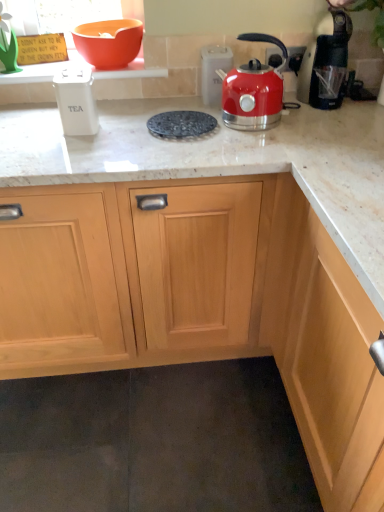
The image size is (384, 512). I want to click on unoccupied area in front of black plastic coffee maker at upper right, arranged as the 1th kitchen appliance when viewed from the right, so click(331, 124).